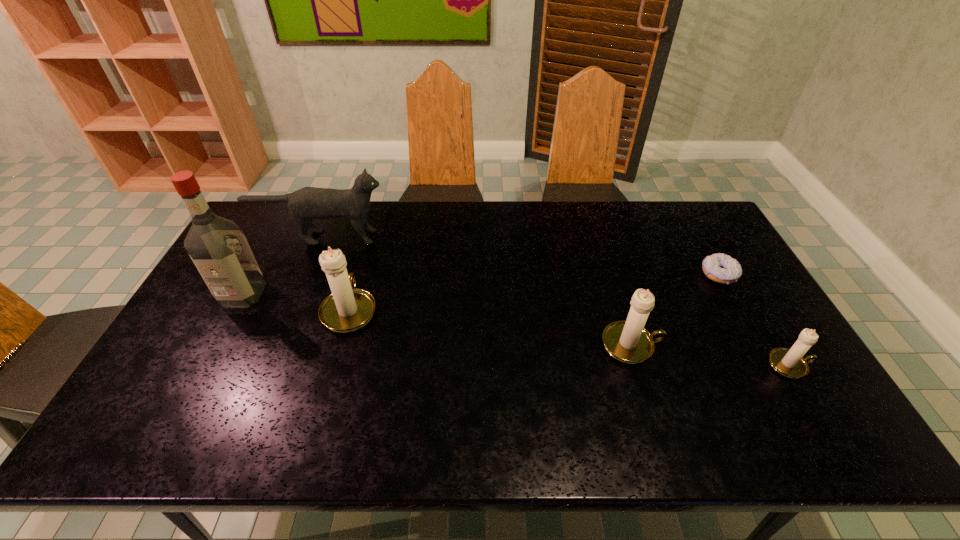
I want to click on vacant space located 0.150m on the handle side of the leftmost candle holder, so click(366, 253).

At what (x,y) coordinates should I click in order to perform the action: click on vacant area situated on the handle side of the fourth object from left to right. Please return your answer as a coordinate pair (x, y). The height and width of the screenshot is (540, 960). Looking at the image, I should click on (774, 345).

At what (x,y) coordinates should I click in order to perform the action: click on free location located 0.290m on the front-facing side of the farthest object. Please return your answer as a coordinate pair (x, y). This screenshot has height=540, width=960. Looking at the image, I should click on (472, 237).

You are a GUI agent. You are given a task and a screenshot of the screen. Output one action in this format:
    pyautogui.click(x=<x>, y=<y>)
    Task: Click on the free space located on the front of the doughnut
    
    Given the screenshot: What is the action you would take?
    pyautogui.click(x=762, y=352)

The width and height of the screenshot is (960, 540). In order to click on vacant region located 0.160m on the front-facing side of the tallest object in this screenshot , I will do `click(210, 355)`.

Where is `object at the far edge`? The width and height of the screenshot is (960, 540). object at the far edge is located at coordinates (308, 203).

Image resolution: width=960 pixels, height=540 pixels. Identify the location of object positioned at the near edge. coord(788,362).

Where is `cat present at the left edge`? The height and width of the screenshot is (540, 960). cat present at the left edge is located at coordinates (308, 203).

Locate an element on the screen. liquor located in the left edge section of the desktop is located at coordinates (217, 246).

Image resolution: width=960 pixels, height=540 pixels. Find the location of `candle holder at the right edge`. candle holder at the right edge is located at coordinates (788, 362).